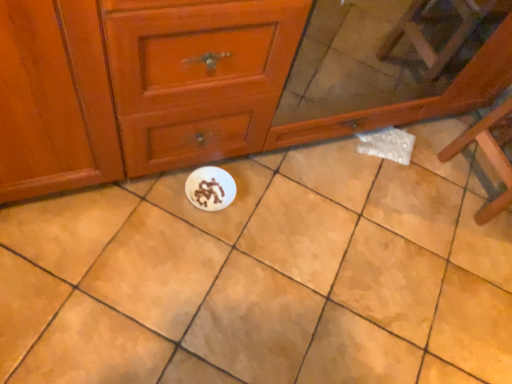
Locate an element on the screen. free spot in front of wooden chair at right is located at coordinates (463, 246).